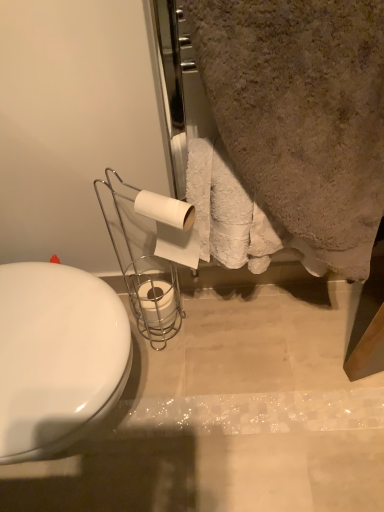
Locate an element on the screen. Image resolution: width=384 pixels, height=512 pixels. white matte toilet paper at center, which appears as the second toilet paper when viewed from the back is located at coordinates (171, 227).

I want to click on bath towel located above the white matte toilet paper at center, positioned as the second toilet paper in bottom-to-top order (from the image's perspective), so click(302, 112).

Does beige textured towel at upper right turn towards white matte toilet paper at center, positioned as the 1th toilet paper in top-to-bottom order?

No, beige textured towel at upper right is not turned towards white matte toilet paper at center, positioned as the 1th toilet paper in top-to-bottom order.

Visually, is beige textured towel at upper right positioned to the left or to the right of white matte toilet paper at center, positioned as the second toilet paper in bottom-to-top order?

From the image, it's evident that beige textured towel at upper right is to the right of white matte toilet paper at center, positioned as the second toilet paper in bottom-to-top order.

In the scene shown: Between white matte toilet paper at center, which ranks as the 2th toilet paper in top-to-bottom order, and white glossy toilet at left, which one appears on the right side from the viewer's perspective?

white matte toilet paper at center, which ranks as the 2th toilet paper in top-to-bottom order, is more to the right.

Where is `the 2nd toilet paper behind the white glossy toilet at left, counting from the anchor's position`? the 2nd toilet paper behind the white glossy toilet at left, counting from the anchor's position is located at coordinates (157, 303).

Can you tell me how much white matte toilet paper at center, which appears as the first toilet paper when ordered from the bottom, and white glossy toilet at left differ in facing direction?

87.1 degrees.

From the image's perspective, is white matte toilet paper at center, the 1th toilet paper from the back, above or below white glossy toilet at left?

From the image's perspective, white matte toilet paper at center, the 1th toilet paper from the back, appears above white glossy toilet at left.

Is white matte toilet paper at center, the 1th toilet paper from the back, situated inside beige textured towel at upper right or outside?

white matte toilet paper at center, the 1th toilet paper from the back, exists outside the volume of beige textured towel at upper right.

Based on their positions, is white matte toilet paper at center, the 2th toilet paper in the front-to-back sequence, located to the left or right of beige textured towel at upper right?

From the image, it's evident that white matte toilet paper at center, the 2th toilet paper in the front-to-back sequence, is to the left of beige textured towel at upper right.

From a real-world perspective, between white matte toilet paper at center, the 2th toilet paper in the front-to-back sequence, and beige textured towel at upper right, who is vertically higher?

beige textured towel at upper right.

Looking at this image, does white matte toilet paper at center, positioned as the second toilet paper in bottom-to-top order, appear on the right side of white glossy toilet at left?

Yes.

Considering the points (178, 231) and (42, 263), which point is in front, point (178, 231) or point (42, 263)?

Point (178, 231)

From a real-world perspective, is white matte toilet paper at center, which is the first toilet paper from front to back, below white glossy toilet at left?

No, from a real-world perspective, white matte toilet paper at center, which is the first toilet paper from front to back, is not beneath white glossy toilet at left.

Between white matte toilet paper at center, which is the first toilet paper from front to back, and white glossy toilet at left, which one has larger size?

white glossy toilet at left is bigger.

From the image's perspective, which one is positioned lower, white matte toilet paper at center, the 1th toilet paper from the back, or white matte toilet paper at center, positioned as the second toilet paper in bottom-to-top order?

From the image's view, white matte toilet paper at center, the 1th toilet paper from the back, is below.

Does white matte toilet paper at center, which ranks as the 2th toilet paper in top-to-bottom order, have a lesser width compared to white matte toilet paper at center, positioned as the 1th toilet paper in top-to-bottom order?

Incorrect, the width of white matte toilet paper at center, which ranks as the 2th toilet paper in top-to-bottom order, is not less than that of white matte toilet paper at center, positioned as the 1th toilet paper in top-to-bottom order.

How different are the orientations of white matte toilet paper at center, the 1th toilet paper from the back, and white matte toilet paper at center, which appears as the second toilet paper when viewed from the back, in degrees?

29.9 degrees separate the facing orientations of white matte toilet paper at center, the 1th toilet paper from the back, and white matte toilet paper at center, which appears as the second toilet paper when viewed from the back.

From a real-world perspective, is white matte toilet paper at center, which ranks as the 2th toilet paper in top-to-bottom order, above or below white matte toilet paper at center, positioned as the second toilet paper in bottom-to-top order?

From a real-world perspective, white matte toilet paper at center, which ranks as the 2th toilet paper in top-to-bottom order, is physically below white matte toilet paper at center, positioned as the second toilet paper in bottom-to-top order.

Would you say white glossy toilet at left contains white matte toilet paper at center, positioned as the second toilet paper in bottom-to-top order?

That's incorrect, white matte toilet paper at center, positioned as the second toilet paper in bottom-to-top order, is not inside white glossy toilet at left.

Consider the image. From a real-world perspective, is white glossy toilet at left below white matte toilet paper at center, which appears as the second toilet paper when viewed from the back?

Yes.

Is white glossy toilet at left facing away from white matte toilet paper at center, positioned as the 1th toilet paper in top-to-bottom order?

white glossy toilet at left is not turned away from white matte toilet paper at center, positioned as the 1th toilet paper in top-to-bottom order.

Is white matte toilet paper at center, which appears as the second toilet paper when viewed from the back, taller or shorter than beige textured towel at upper right?

Clearly, white matte toilet paper at center, which appears as the second toilet paper when viewed from the back, is shorter compared to beige textured towel at upper right.

From the image's perspective, would you say white matte toilet paper at center, which is the first toilet paper from front to back, is positioned over beige textured towel at upper right?

Actually, white matte toilet paper at center, which is the first toilet paper from front to back, appears below beige textured towel at upper right in the image.

Is white matte toilet paper at center, positioned as the second toilet paper in bottom-to-top order, outside of beige textured towel at upper right?

Yes, white matte toilet paper at center, positioned as the second toilet paper in bottom-to-top order, is located beyond the bounds of beige textured towel at upper right.

Are white matte toilet paper at center, positioned as the second toilet paper in bottom-to-top order, and beige textured towel at upper right beside each other?

No, white matte toilet paper at center, positioned as the second toilet paper in bottom-to-top order, is not making contact with beige textured towel at upper right.

Locate an element on the screen. The image size is (384, 512). bath towel that is above the white matte toilet paper at center, positioned as the 1th toilet paper in top-to-bottom order (from a real-world perspective) is located at coordinates (302, 112).

Image resolution: width=384 pixels, height=512 pixels. Identify the location of toilet paper that is under the white glossy toilet at left (from a real-world perspective). (157, 303).

Estimate the real-world distances between objects in this image. Which object is further from beige textured towel at upper right, white matte toilet paper at center, which is the first toilet paper from front to back, or white matte toilet paper at center, which appears as the first toilet paper when ordered from the bottom?

Based on the image, white matte toilet paper at center, which appears as the first toilet paper when ordered from the bottom, appears to be further to beige textured towel at upper right.

Considering their positions, is white matte toilet paper at center, positioned as the second toilet paper in bottom-to-top order, positioned further to white glossy toilet at left than white matte toilet paper at center, which appears as the first toilet paper when ordered from the bottom?

white matte toilet paper at center, which appears as the first toilet paper when ordered from the bottom.

Estimate the real-world distances between objects in this image. Which object is further from white matte toilet paper at center, the 1th toilet paper from the back, white matte toilet paper at center, which appears as the second toilet paper when viewed from the back, or beige textured towel at upper right?

beige textured towel at upper right is positioned further to the anchor white matte toilet paper at center, the 1th toilet paper from the back.

In the scene shown: When comparing their distances from white glossy toilet at left, does white matte toilet paper at center, which ranks as the 2th toilet paper in top-to-bottom order, or white matte toilet paper at center, which is the first toilet paper from front to back, seem closer?

white matte toilet paper at center, which is the first toilet paper from front to back, is closer to white glossy toilet at left.

Considering their positions, is white glossy toilet at left positioned closer to white matte toilet paper at center, which ranks as the 2th toilet paper in top-to-bottom order, than white matte toilet paper at center, positioned as the 1th toilet paper in top-to-bottom order?

white matte toilet paper at center, positioned as the 1th toilet paper in top-to-bottom order, is positioned closer to the anchor white matte toilet paper at center, which ranks as the 2th toilet paper in top-to-bottom order.

Looking at the image, which one is located closer to beige textured towel at upper right, white matte toilet paper at center, the 1th toilet paper from the back, or white glossy toilet at left?

white glossy toilet at left is closer to beige textured towel at upper right.

Estimate the real-world distances between objects in this image. Which object is closer to white matte toilet paper at center, the 1th toilet paper from the back, beige textured towel at upper right or white glossy toilet at left?

white glossy toilet at left lies closer to white matte toilet paper at center, the 1th toilet paper from the back, than the other object.

From the image, which object appears to be farther from white matte toilet paper at center, positioned as the second toilet paper in bottom-to-top order, beige textured towel at upper right or white matte toilet paper at center, the 1th toilet paper from the back?

white matte toilet paper at center, the 1th toilet paper from the back, is further to white matte toilet paper at center, positioned as the second toilet paper in bottom-to-top order.

Locate an element on the screen. The width and height of the screenshot is (384, 512). toilet located between beige textured towel at upper right and white matte toilet paper at center, which ranks as the 2th toilet paper in top-to-bottom order, in the depth direction is located at coordinates (57, 356).

Identify the location of toilet paper located between white glossy toilet at left and white matte toilet paper at center, the 2th toilet paper in the front-to-back sequence, in the depth direction. The width and height of the screenshot is (384, 512). (171, 227).

You are a GUI agent. You are given a task and a screenshot of the screen. Output one action in this format:
    pyautogui.click(x=<x>, y=<y>)
    Task: Click on the toilet paper positioned between beige textured towel at upper right and white matte toilet paper at center, the 2th toilet paper in the front-to-back sequence, from near to far
    The image size is (384, 512).
    Given the screenshot: What is the action you would take?
    pyautogui.click(x=171, y=227)